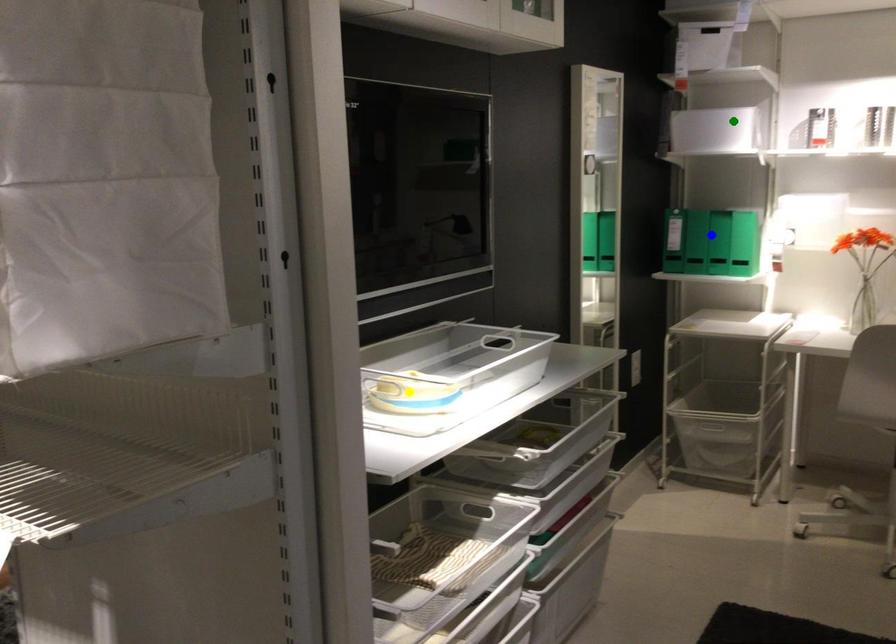
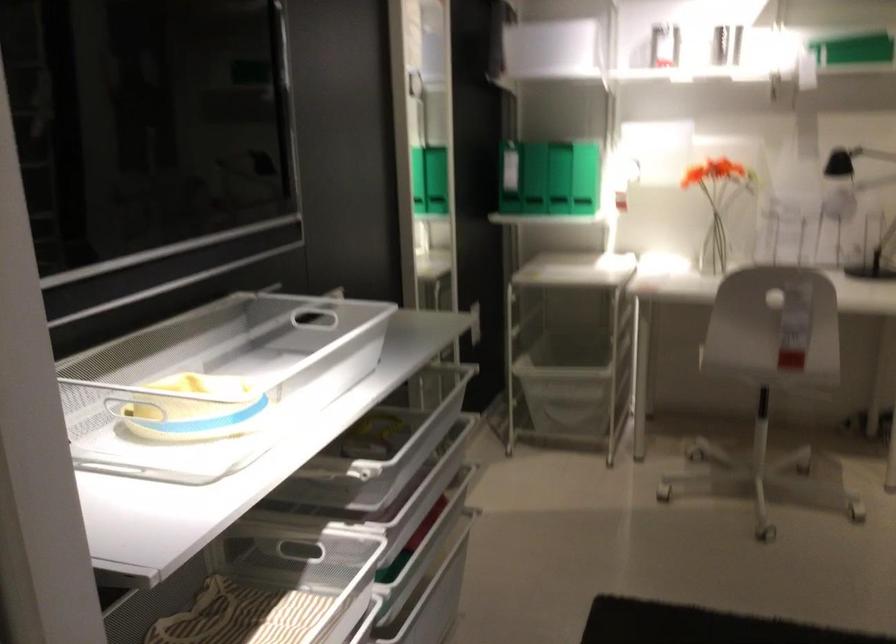
I am providing you with two images of the same scene from different viewpoints. Three points are marked in image1. Which point corresponds to a part or object that is occluded in image2?In image1, three points are marked. Which of them correspond to a part or object that is occluded in image2?Among the three points shown in image1, which one corresponds to a part or object that is no longer visible due to occlusion in image2?

Invisible in image2: yellow point.